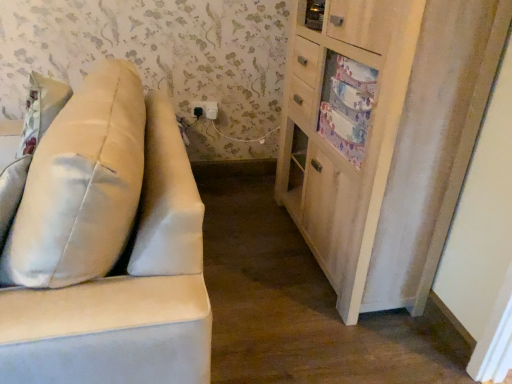
This screenshot has height=384, width=512. What do you see at coordinates (388, 143) in the screenshot? I see `light wood cabinet at right` at bounding box center [388, 143].

Describe the element at coordinates (29, 142) in the screenshot. I see `satin beige pillow at left` at that location.

At what (x,y) coordinates should I click in order to perform the action: click on suede-like beige sofa at left. Please return your answer as a coordinate pair (x, y). Image resolution: width=512 pixels, height=384 pixels. Looking at the image, I should click on (106, 247).

Is suede-like beige sofa at left aimed at black plastic electric outlet at upper center?

No, suede-like beige sofa at left is not turned towards black plastic electric outlet at upper center.

This screenshot has height=384, width=512. I want to click on electric outlet above the suede-like beige sofa at left (from a real-world perspective), so click(207, 108).

Is suede-like beige sofa at left taller than black plastic electric outlet at upper center?

Indeed, suede-like beige sofa at left has a greater height compared to black plastic electric outlet at upper center.

Is black plastic electric outlet at upper center not close to suede-like beige sofa at left?

black plastic electric outlet at upper center is positioned a significant distance from suede-like beige sofa at left.

Identify the location of studio couch located underneath the black plastic electric outlet at upper center (from a real-world perspective). (106, 247).

Based on the photo, considering the sizes of objects black plastic electric outlet at upper center and suede-like beige sofa at left in the image provided, who is bigger, black plastic electric outlet at upper center or suede-like beige sofa at left?

suede-like beige sofa at left.

Does black plastic electric outlet at upper center contain suede-like beige sofa at left?

No, suede-like beige sofa at left is not a part of black plastic electric outlet at upper center.

Does light wood cabinet at right lie behind satin beige pillow at left?

Yes.

Which is closer, (429,19) or (25,160)?

Point (25,160)

Which object is thinner, light wood cabinet at right or satin beige pillow at left?

With smaller width is satin beige pillow at left.

Which of these two, light wood cabinet at right or satin beige pillow at left, stands taller?

With more height is light wood cabinet at right.

Is suede-like beige sofa at left at the back of satin beige pillow at left?

Yes.

From the image's perspective, would you say satin beige pillow at left is shown under suede-like beige sofa at left?

No, from the image's perspective, satin beige pillow at left is not beneath suede-like beige sofa at left.

Between satin beige pillow at left and suede-like beige sofa at left, which one appears on the left side from the viewer's perspective?

suede-like beige sofa at left is more to the left.

Which is nearer, (66, 198) or (145, 127)?

Point (66, 198) appears to be closer to the viewer than point (145, 127).

Considering the positions of objects satin beige pillow at left and black plastic electric outlet at upper center in the image provided, who is more to the right, satin beige pillow at left or black plastic electric outlet at upper center?

From the viewer's perspective, black plastic electric outlet at upper center appears more on the right side.

Considering the sizes of objects satin beige pillow at left and black plastic electric outlet at upper center in the image provided, who is shorter, satin beige pillow at left or black plastic electric outlet at upper center?

black plastic electric outlet at upper center is shorter.

Is black plastic electric outlet at upper center located within satin beige pillow at left?

That's incorrect, black plastic electric outlet at upper center is not inside satin beige pillow at left.

Would you say satin beige pillow at left is to the left or to the right of light wood cabinet at right in the picture?

satin beige pillow at left is positioned on light wood cabinet at right's left side.

In terms of height, does satin beige pillow at left look taller or shorter compared to light wood cabinet at right?

In the image, satin beige pillow at left appears to be shorter than light wood cabinet at right.

From a real-world perspective, which is physically below, satin beige pillow at left or light wood cabinet at right?

light wood cabinet at right.

What's the angular difference between satin beige pillow at left and light wood cabinet at right's facing directions?

9.43 degrees separate the facing orientations of satin beige pillow at left and light wood cabinet at right.

Would you say light wood cabinet at right is inside or outside suede-like beige sofa at left?

light wood cabinet at right is spatially situated outside suede-like beige sofa at left.

From the image's perspective, is light wood cabinet at right above or below suede-like beige sofa at left?

Clearly, from the image's perspective, light wood cabinet at right is above suede-like beige sofa at left.

Can you confirm if light wood cabinet at right is taller than suede-like beige sofa at left?

Yes, light wood cabinet at right is taller than suede-like beige sofa at left.

Image resolution: width=512 pixels, height=384 pixels. In order to click on studio couch in front of the black plastic electric outlet at upper center in this screenshot , I will do [106, 247].

This screenshot has height=384, width=512. Find the location of `studio couch on the left of black plastic electric outlet at upper center`. studio couch on the left of black plastic electric outlet at upper center is located at coordinates (106, 247).

Looking at the image, which one is located closer to satin beige pillow at left, black plastic electric outlet at upper center or light wood cabinet at right?

light wood cabinet at right is closer to satin beige pillow at left.

Considering their positions, is suede-like beige sofa at left positioned closer to black plastic electric outlet at upper center than light wood cabinet at right?

Among the two, light wood cabinet at right is located nearer to black plastic electric outlet at upper center.

When comparing their distances from suede-like beige sofa at left, does satin beige pillow at left or light wood cabinet at right seem further?

light wood cabinet at right is positioned further to the anchor suede-like beige sofa at left.

Looking at the image, which one is located closer to light wood cabinet at right, satin beige pillow at left or suede-like beige sofa at left?

suede-like beige sofa at left is positioned closer to the anchor light wood cabinet at right.

Based on their spatial positions, is satin beige pillow at left or light wood cabinet at right closer to suede-like beige sofa at left?

Among the two, satin beige pillow at left is located nearer to suede-like beige sofa at left.

Looking at the image, which one is located further to light wood cabinet at right, satin beige pillow at left or black plastic electric outlet at upper center?

black plastic electric outlet at upper center is further to light wood cabinet at right.

In the scene shown: Considering their positions, is satin beige pillow at left positioned further to suede-like beige sofa at left than satin beige pillow at left?

satin beige pillow at left is positioned further to the anchor suede-like beige sofa at left.

Which object lies further to the anchor point light wood cabinet at right, black plastic electric outlet at upper center or satin beige pillow at left?

black plastic electric outlet at upper center is further to light wood cabinet at right.

This screenshot has width=512, height=384. I want to click on cabinetry between satin beige pillow at left and black plastic electric outlet at upper center along the z-axis, so click(x=388, y=143).

This screenshot has height=384, width=512. In order to click on pillow between suede-like beige sofa at left and black plastic electric outlet at upper center along the z-axis in this screenshot , I will do `click(29, 142)`.

The height and width of the screenshot is (384, 512). Find the location of `pillow positioned between satin beige pillow at left and black plastic electric outlet at upper center from near to far`. pillow positioned between satin beige pillow at left and black plastic electric outlet at upper center from near to far is located at coordinates (29, 142).

Find the location of a particular element. Image resolution: width=512 pixels, height=384 pixels. throw pillow between suede-like beige sofa at left and black plastic electric outlet at upper center along the z-axis is located at coordinates (81, 185).